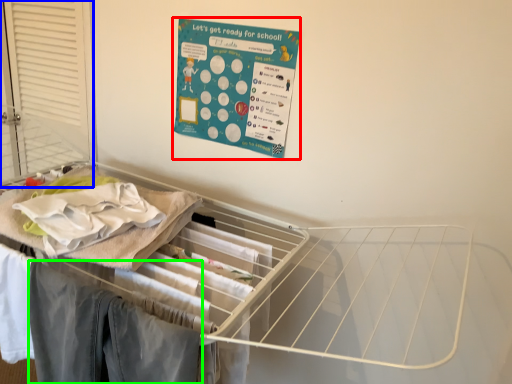
Question: Which object is positioned closest to poster (highlighted by a red box)? Select from screen door (highlighted by a blue box) and clothing (highlighted by a green box).

Choices:
 (A) screen door
 (B) clothing

Answer: (A)